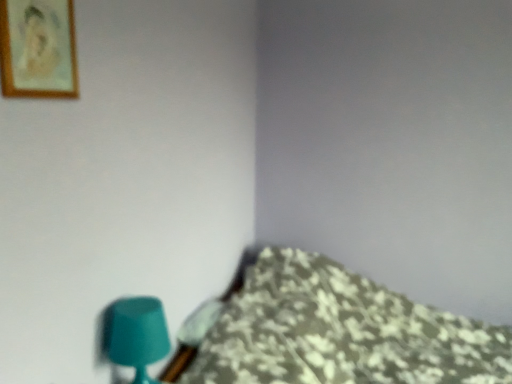
Question: Should I look upward or downward to see floral fabric bedspread at lower right?

Choices:
 (A) down
 (B) up

Answer: (A)

Question: Is wooden framed portrait at upper left facing towards floral fabric bedspread at lower right?

Choices:
 (A) no
 (B) yes

Answer: (A)

Question: Is wooden framed portrait at upper left facing away from floral fabric bedspread at lower right?

Choices:
 (A) no
 (B) yes

Answer: (A)

Question: From the image's perspective, would you say wooden framed portrait at upper left is shown under floral fabric bedspread at lower right?

Choices:
 (A) no
 (B) yes

Answer: (A)

Question: Considering the relative sizes of wooden framed portrait at upper left and floral fabric bedspread at lower right in the image provided, is wooden framed portrait at upper left shorter than floral fabric bedspread at lower right?

Choices:
 (A) yes
 (B) no

Answer: (A)

Question: Is wooden framed portrait at upper left further to the viewer compared to floral fabric bedspread at lower right?

Choices:
 (A) no
 (B) yes

Answer: (A)

Question: Would you say wooden framed portrait at upper left is outside floral fabric bedspread at lower right?

Choices:
 (A) no
 (B) yes

Answer: (B)

Question: From a real-world perspective, does floral fabric bedspread at lower right stand above teal matte table lamp at lower left?

Choices:
 (A) no
 (B) yes

Answer: (A)

Question: Would you say floral fabric bedspread at lower right is outside teal matte table lamp at lower left?

Choices:
 (A) no
 (B) yes

Answer: (B)

Question: From the image's perspective, is floral fabric bedspread at lower right under teal matte table lamp at lower left?

Choices:
 (A) no
 (B) yes

Answer: (B)

Question: Is floral fabric bedspread at lower right positioned behind teal matte table lamp at lower left?

Choices:
 (A) no
 (B) yes

Answer: (A)

Question: Does floral fabric bedspread at lower right come in front of teal matte table lamp at lower left?

Choices:
 (A) yes
 (B) no

Answer: (A)

Question: From a real-world perspective, is floral fabric bedspread at lower right under teal matte table lamp at lower left?

Choices:
 (A) no
 (B) yes

Answer: (B)

Question: From a real-world perspective, is wooden framed portrait at upper left located higher than teal matte table lamp at lower left?

Choices:
 (A) yes
 (B) no

Answer: (A)